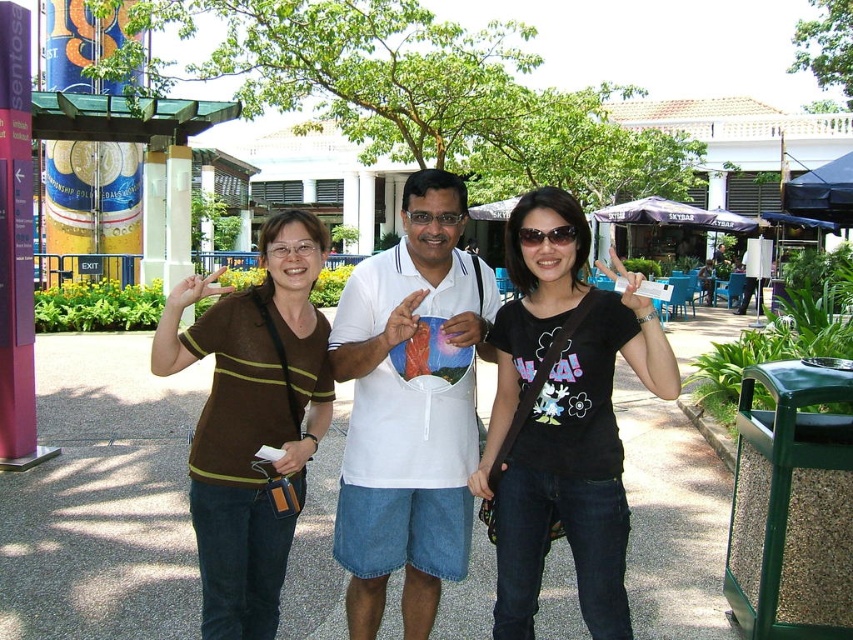
Question: In this image, where is black plastic sunglasses at center located relative to matte white glasses at center?

Choices:
 (A) above
 (B) below

Answer: (B)

Question: Considering the relative positions of brown striped shirt at left and white cotton polo shirt at center in the image provided, where is brown striped shirt at left located with respect to white cotton polo shirt at center?

Choices:
 (A) above
 (B) below

Answer: (B)

Question: Is black matte shirt at center below white cotton polo shirt at center?

Choices:
 (A) no
 (B) yes

Answer: (B)

Question: Which object is the farthest from the matte brown sweater at center?

Choices:
 (A) brown striped shirt at left
 (B) black plastic sunglasses at center
 (C) black matte shirt at center

Answer: (B)

Question: Which object is farther from the camera taking this photo?

Choices:
 (A) black plastic sunglasses at center
 (B) white cotton polo shirt at center
 (C) matte white glasses at center
 (D) matte brown sweater at center

Answer: (C)

Question: Which of these objects is positioned farthest from the matte white glasses at center?

Choices:
 (A) black plastic sunglasses at center
 (B) matte brown sweater at center
 (C) white cotton polo shirt at center
 (D) black matte shirt at center

Answer: (D)